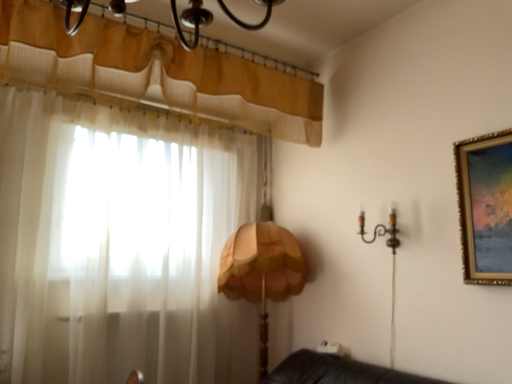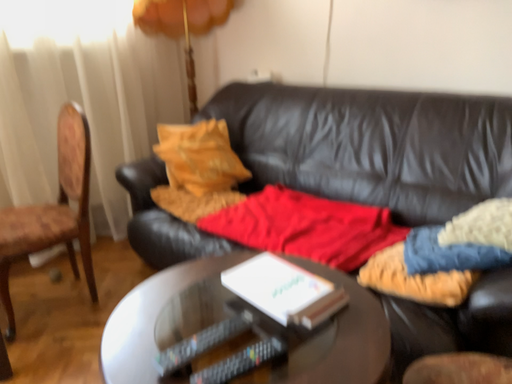
Question: How did the camera likely rotate when shooting the video?

Choices:
 (A) rotated left
 (B) rotated right

Answer: (B)